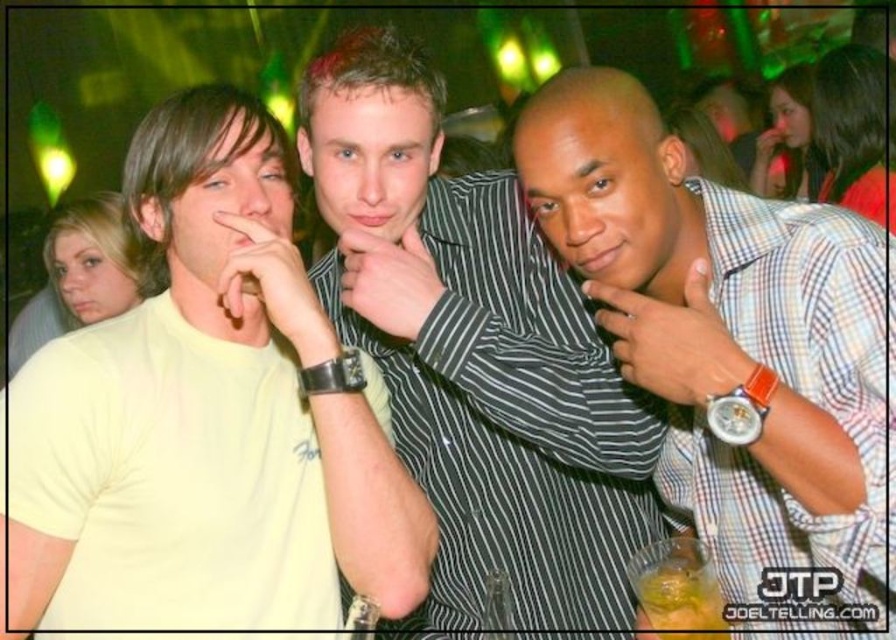
You are a photographer trying to adjust the lighting in the nightclub scene. You notice the plaid shirt at center and the striped shirt at center. Which shirt should you focus your spotlight on to ensure it reaches the taller one first?

The striped shirt at center is taller than the plaid shirt at center, so you should focus the spotlight on the striped shirt at center first to ensure it reaches the taller one.